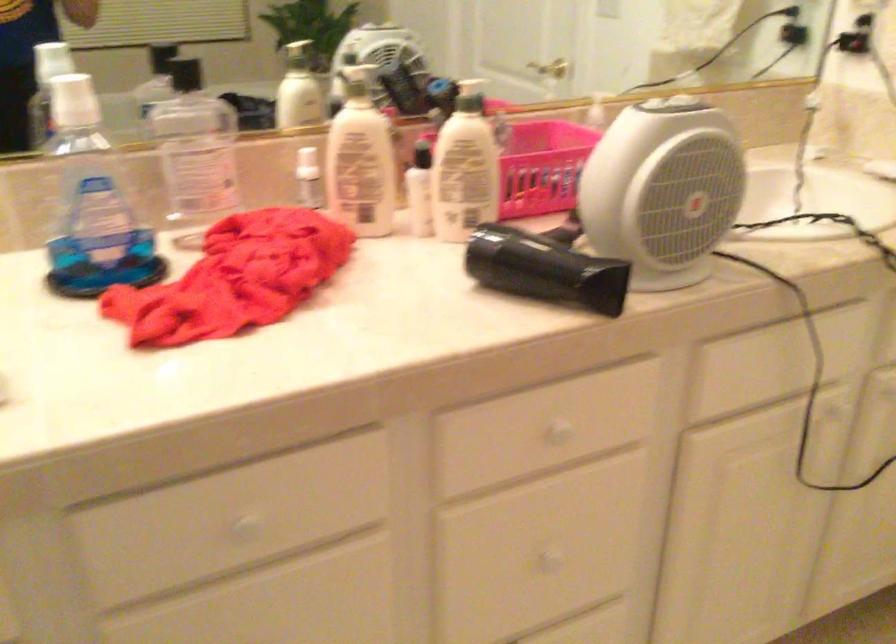
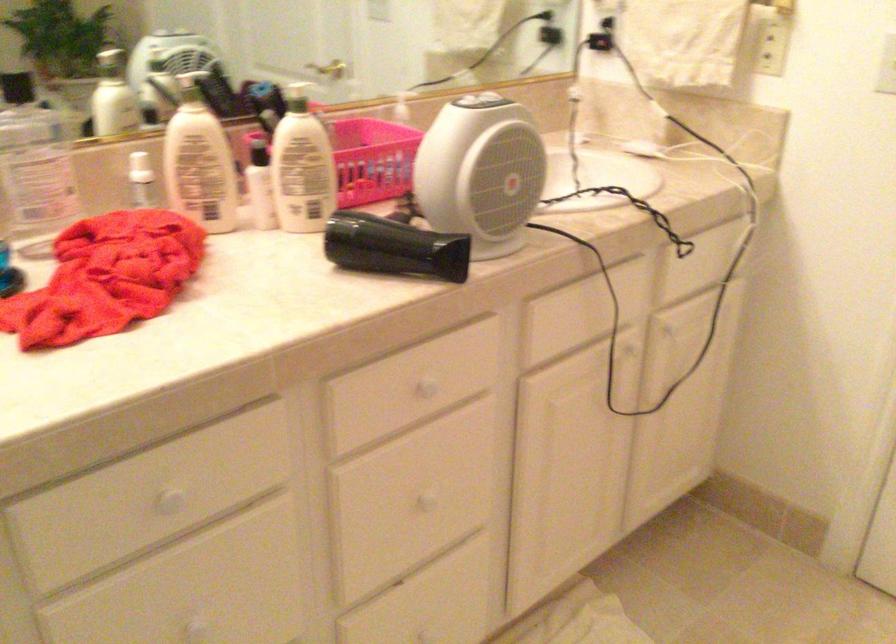
Where in the second image is the point corresponding to (x=305, y=162) from the first image?

(140, 167)